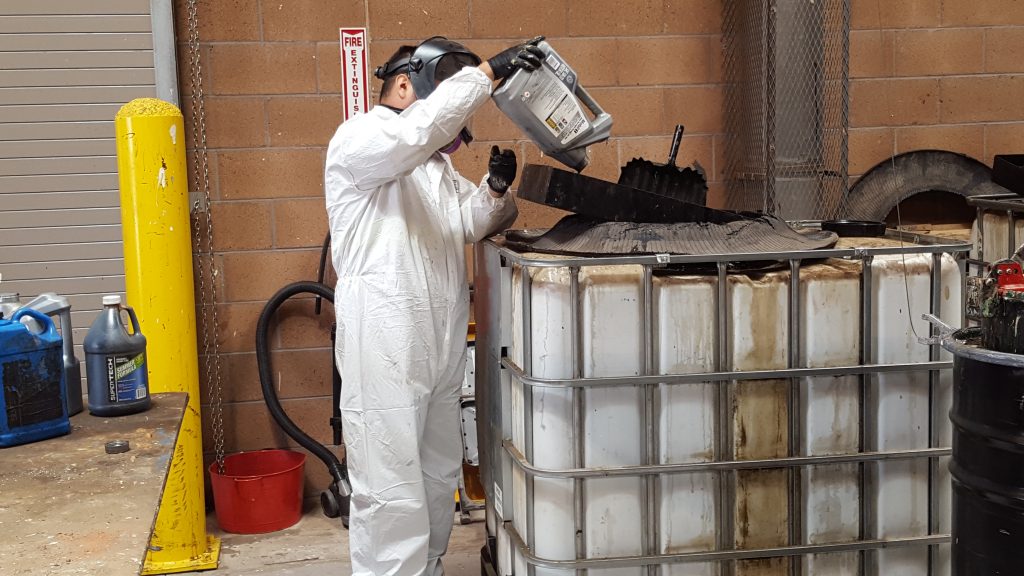
I want to click on red bucket, so click(280, 503).